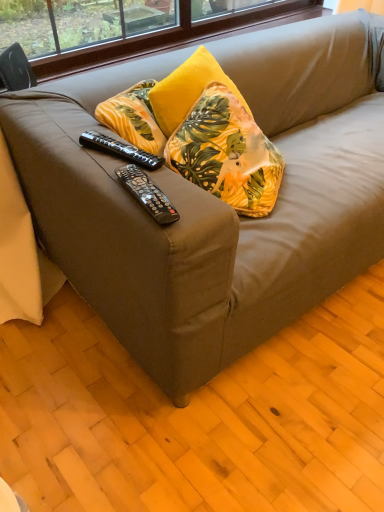
Question: Should I look upward or downward to see black plastic remote control at center, placed as the first remote control when sorted from top to bottom?

Choices:
 (A) down
 (B) up

Answer: (B)

Question: Is yellow fabric pillow at center not within black plastic remote control at center, the 1th remote control positioned from the front?

Choices:
 (A) no
 (B) yes

Answer: (B)

Question: Would you say yellow fabric pillow at center contains black plastic remote control at center, which is the 2th remote control from top to bottom?

Choices:
 (A) no
 (B) yes

Answer: (A)

Question: Can you confirm if yellow fabric pillow at center is bigger than black plastic remote control at center, marked as the first remote control in a bottom-to-top arrangement?

Choices:
 (A) no
 (B) yes

Answer: (B)

Question: Can you confirm if yellow fabric pillow at center is shorter than black plastic remote control at center, marked as the first remote control in a bottom-to-top arrangement?

Choices:
 (A) no
 (B) yes

Answer: (A)

Question: Does yellow fabric pillow at center lie behind black plastic remote control at center, the 1th remote control positioned from the front?

Choices:
 (A) yes
 (B) no

Answer: (A)

Question: Does yellow fabric pillow at center have a greater height compared to black plastic remote control at center, the 1th remote control positioned from the front?

Choices:
 (A) no
 (B) yes

Answer: (B)

Question: Is the position of black plastic remote control at center, which is the 2th remote control from top to bottom, less distant than that of yellow fabric pillow at center?

Choices:
 (A) yes
 (B) no

Answer: (A)

Question: Is black plastic remote control at center, positioned as the second remote control in back-to-front order, with yellow fabric pillow at center?

Choices:
 (A) yes
 (B) no

Answer: (B)

Question: Does black plastic remote control at center, positioned as the second remote control in back-to-front order, contain yellow fabric pillow at center?

Choices:
 (A) yes
 (B) no

Answer: (B)

Question: Is black plastic remote control at center, which is the 2th remote control from top to bottom, behind yellow fabric pillow at center?

Choices:
 (A) yes
 (B) no

Answer: (B)

Question: Can you confirm if black plastic remote control at center, positioned as the second remote control in back-to-front order, is smaller than yellow fabric pillow at center?

Choices:
 (A) no
 (B) yes

Answer: (B)

Question: From a real-world perspective, is black plastic remote control at center, which is the 2th remote control from top to bottom, beneath yellow fabric pillow at center?

Choices:
 (A) yes
 (B) no

Answer: (B)

Question: Is black plastic remote control at center, placed as the first remote control when sorted from top to bottom, closer to camera compared to yellow fabric pillow at center?

Choices:
 (A) yes
 (B) no

Answer: (A)